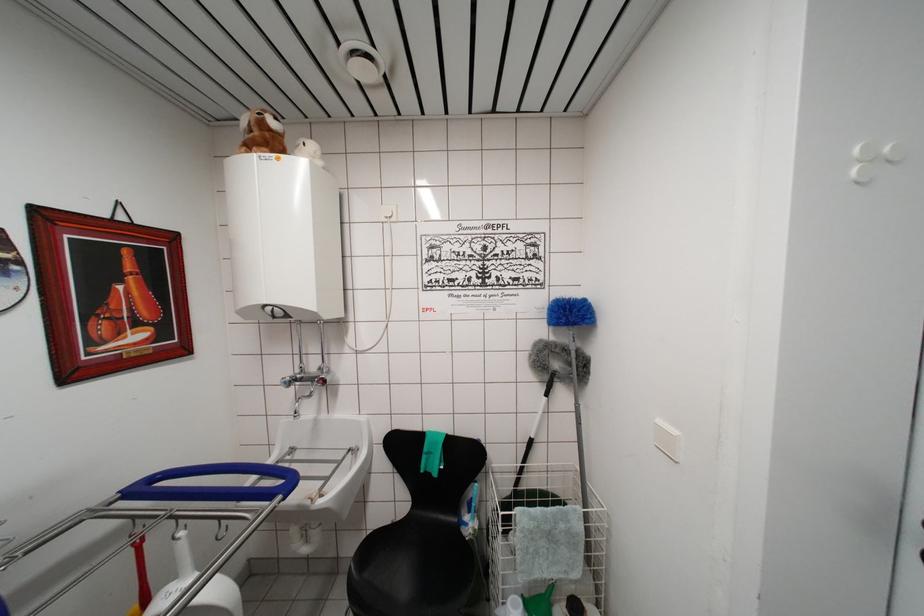
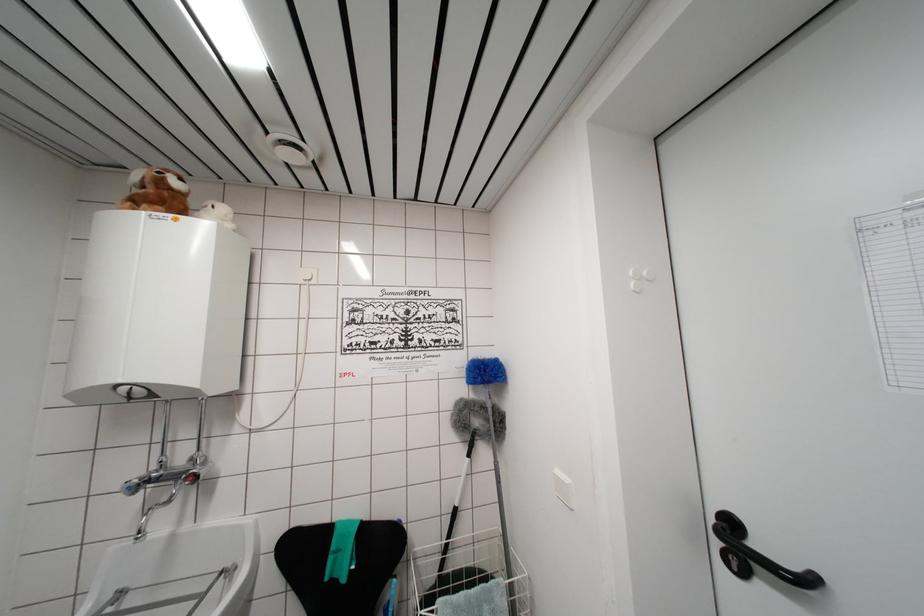
In the second image, find the point that corresponds to the point at 865,167 in the first image.

(638, 285)